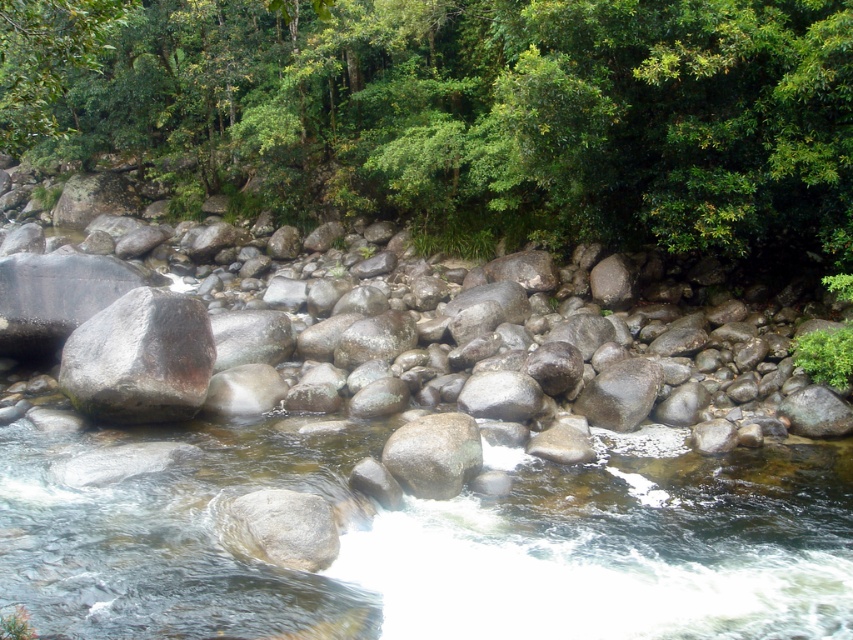
Which is more to the left, gray rough rock at left or smooth gray rock at center-right?

gray rough rock at left

Which is behind, point (93, 416) or point (608, 413)?

The point (608, 413) is more distant.

Where is `gray rough rock at left`? The width and height of the screenshot is (853, 640). gray rough rock at left is located at coordinates (140, 358).

Who is positioned more to the right, green leafy tree at upper center or gray smooth rock at center?

From the viewer's perspective, gray smooth rock at center appears more on the right side.

This screenshot has height=640, width=853. In order to click on green leafy tree at upper center in this screenshot , I will do `click(461, 112)`.

Identify the location of green leafy tree at upper center. This screenshot has height=640, width=853. (461, 112).

Who is more forward, (x=138, y=67) or (x=476, y=461)?

Point (x=476, y=461) is in front.

Is green leafy tree at upper center closer to camera compared to gray rough rock at center?

Yes, it is.

Identify the location of green leafy tree at upper center. The height and width of the screenshot is (640, 853). (461, 112).